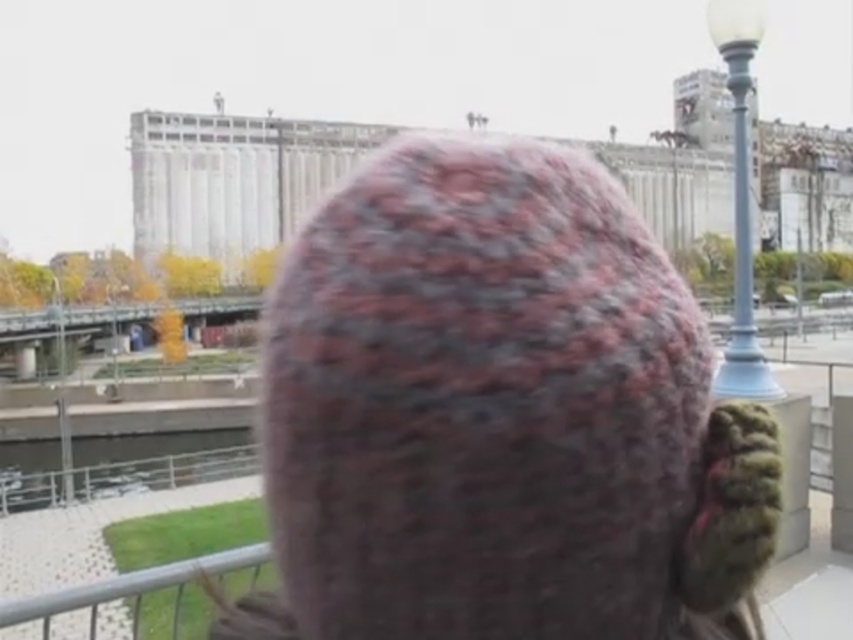
You are an architect designing a new outdoor space. You need to ensure that the light blue glass lamp post at upper right and the metallic silver rail at lower left are visible from a distance. Given their sizes, which object should you place closer to the viewer to maintain visibility?

The light blue glass lamp post at upper right is larger in size than the metallic silver rail at lower left. To maintain visibility, you should place the metallic silver rail at lower left closer to the viewer since smaller objects need to be nearer to ensure they are seen clearly from a distance.

You are standing at the point closer to the camera between the two points, point (12, 500) and point (740, 198). Which point are you standing at?

You are standing at point (12, 500) because it is further to the camera than point (740, 198).